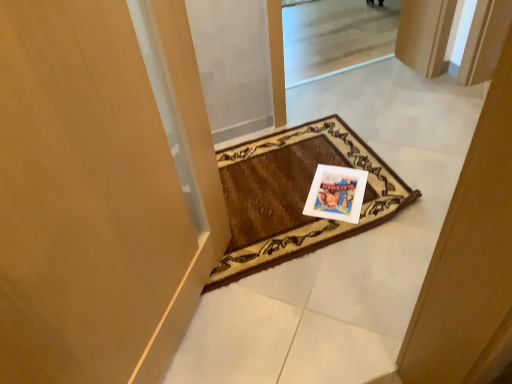
Question: Does white paper postcard at center have a greater width compared to brown woven mat at center?

Choices:
 (A) yes
 (B) no

Answer: (B)

Question: Does white paper postcard at center have a greater height compared to brown woven mat at center?

Choices:
 (A) no
 (B) yes

Answer: (A)

Question: Can you confirm if white paper postcard at center is bigger than brown woven mat at center?

Choices:
 (A) yes
 (B) no

Answer: (B)

Question: Does white paper postcard at center come in front of brown woven mat at center?

Choices:
 (A) yes
 (B) no

Answer: (B)

Question: Are white paper postcard at center and brown woven mat at center located far from each other?

Choices:
 (A) no
 (B) yes

Answer: (A)

Question: Is white paper postcard at center at the right side of brown woven mat at center?

Choices:
 (A) yes
 (B) no

Answer: (A)

Question: Can you confirm if brown woven mat at center is smaller than white paper postcard at center?

Choices:
 (A) yes
 (B) no

Answer: (B)

Question: Is brown woven mat at center to the left of white paper postcard at center from the viewer's perspective?

Choices:
 (A) yes
 (B) no

Answer: (A)

Question: Is brown woven mat at center looking in the opposite direction of white paper postcard at center?

Choices:
 (A) yes
 (B) no

Answer: (B)

Question: Can you see brown woven mat at center touching white paper postcard at center?

Choices:
 (A) yes
 (B) no

Answer: (B)

Question: Would you say brown woven mat at center is outside white paper postcard at center?

Choices:
 (A) no
 (B) yes

Answer: (B)

Question: Does brown woven mat at center have a lesser height compared to white paper postcard at center?

Choices:
 (A) yes
 (B) no

Answer: (B)

Question: In the image, is white paper postcard at center positioned in front of or behind brown woven mat at center?

Choices:
 (A) front
 (B) behind

Answer: (B)